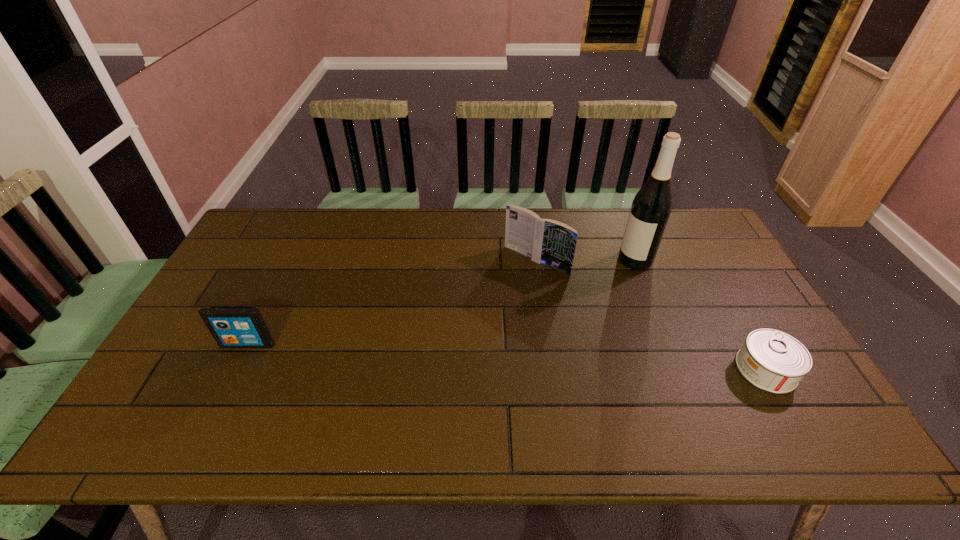
Locate an element on the screen. This screenshot has width=960, height=540. free space located on the label of the third object from left to right is located at coordinates (544, 336).

The width and height of the screenshot is (960, 540). What are the coordinates of `blank space located 0.160m on the label of the third object from left to right` in the screenshot? It's located at (596, 293).

Identify the location of free point located 0.290m on the label of the third object from left to right. (569, 315).

This screenshot has width=960, height=540. I want to click on vacant space located 0.050m on the front cover of the book, so click(510, 282).

In order to click on vacant region located on the front cover of the book in this screenshot , I will do `click(499, 294)`.

At what (x,y) coordinates should I click in order to perform the action: click on vacant space situated on the front cover of the book. Please return your answer as a coordinate pair (x, y). The height and width of the screenshot is (540, 960). Looking at the image, I should click on (457, 335).

Locate an element on the screen. The width and height of the screenshot is (960, 540). wine bottle at the far edge is located at coordinates (651, 207).

The width and height of the screenshot is (960, 540). I want to click on book present at the far edge, so click(x=544, y=241).

At what (x,y) coordinates should I click in order to perform the action: click on object positioned at the near edge. Please return your answer as a coordinate pair (x, y). The width and height of the screenshot is (960, 540). Looking at the image, I should click on (771, 360).

The height and width of the screenshot is (540, 960). Identify the location of object positioned at the left edge. (231, 326).